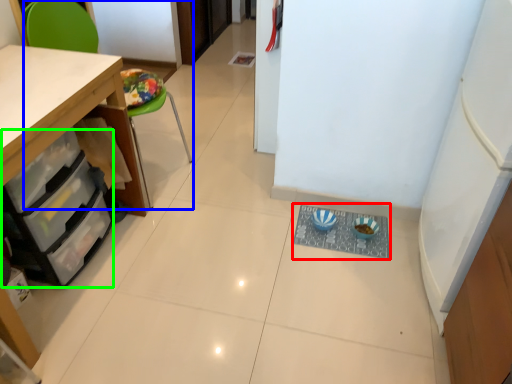
Question: Considering the real-world distances, which object is closest to wide (highlighted by a red box)? chair (highlighted by a blue box) or drawer (highlighted by a green box).

Choices:
 (A) chair
 (B) drawer

Answer: (B)